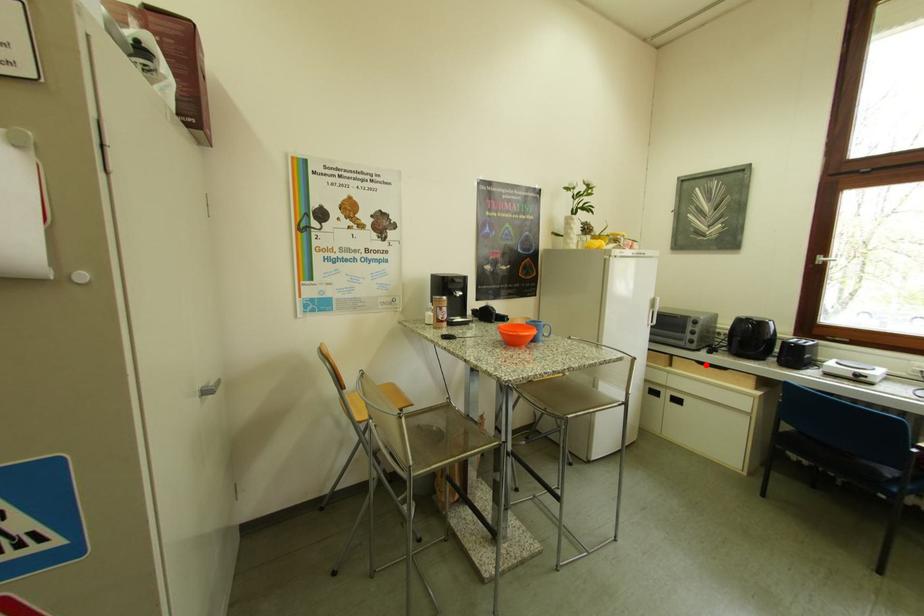
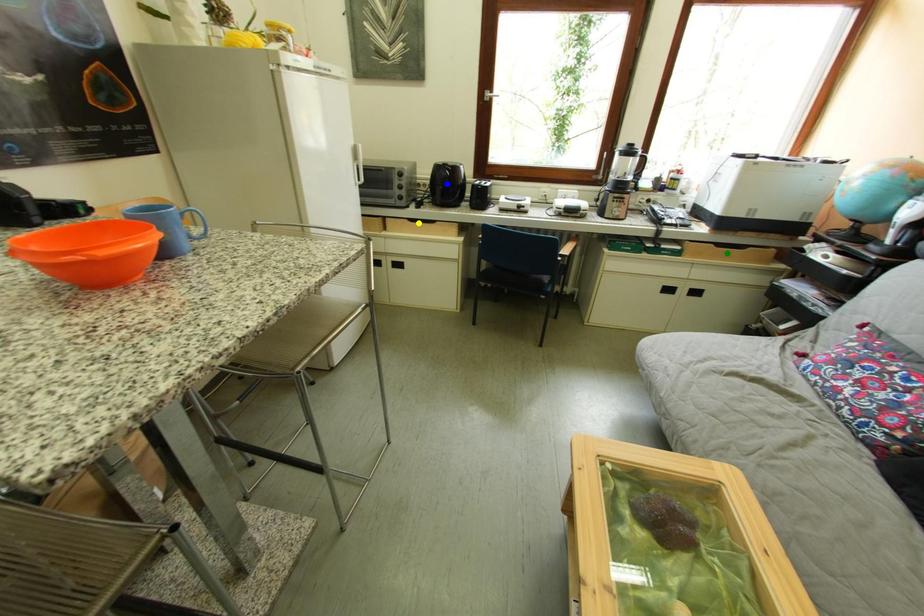
Question: I am providing you with two images of the same scene from different viewpoints. A red point is marked on the first image. You are given multiple points on the second image. Which point in image 2 represents the same 3d spot as the red point in image 1?

Choices:
 (A) blue point
 (B) yellow point
 (C) green point

Answer: (B)